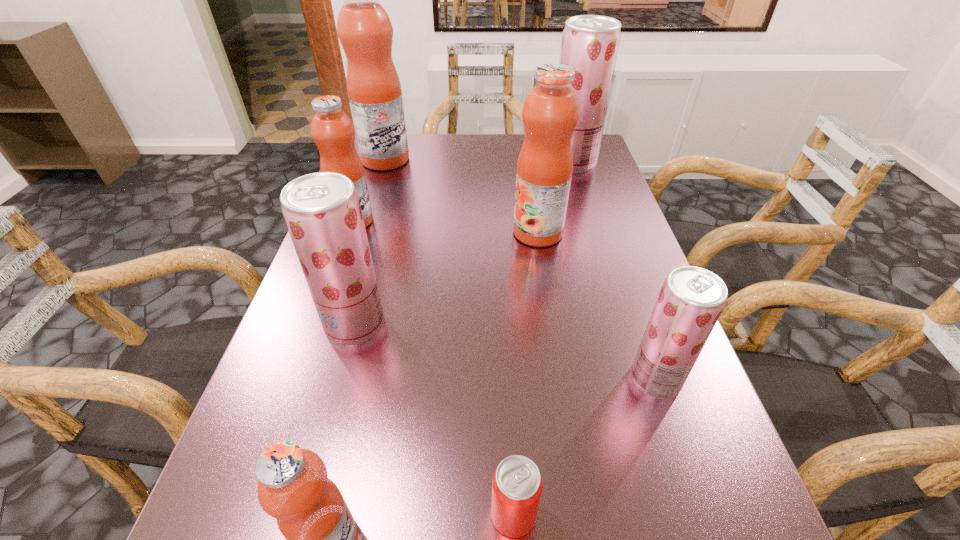
The image size is (960, 540). Identify the location of the closest object to the farthest strawberry fruit juice. (550, 113).

This screenshot has width=960, height=540. Identify the location of fruit juice that stands as the third closest to the rightmost orange fruit juice. (691, 300).

This screenshot has width=960, height=540. In order to click on fruit juice that is the second closest one to the biggest strawberry fruit juice in this screenshot , I will do `click(365, 31)`.

The height and width of the screenshot is (540, 960). I want to click on orange fruit juice that stands as the third closest to the farthest strawberry fruit juice, so click(332, 130).

Where is `the second closest orange fruit juice to the smallest strawberry fruit juice`? the second closest orange fruit juice to the smallest strawberry fruit juice is located at coordinates (321, 534).

Locate an element on the screen. This screenshot has width=960, height=540. strawberry fruit juice that is the closest to the tallest fruit juice is located at coordinates (590, 43).

This screenshot has height=540, width=960. I want to click on strawberry fruit juice that is the closest to the second biggest strawberry fruit juice, so click(691, 300).

This screenshot has width=960, height=540. In order to click on vacant space that satisfies the following two spatial constraints: 1. on the front label of the third nearest fruit juice; 2. on the left side of the second smallest orange fruit juice in this screenshot , I will do `click(318, 325)`.

Where is `blank area in the image that satisfies the following two spatial constraints: 1. on the front label of the biggest orange fruit juice; 2. on the right side of the biggest strawberry fruit juice`? The height and width of the screenshot is (540, 960). blank area in the image that satisfies the following two spatial constraints: 1. on the front label of the biggest orange fruit juice; 2. on the right side of the biggest strawberry fruit juice is located at coordinates (385, 162).

Identify the location of vacant space that satisfies the following two spatial constraints: 1. on the back side of the farthest strawberry fruit juice; 2. on the front label of the tallest fruit juice. (571, 160).